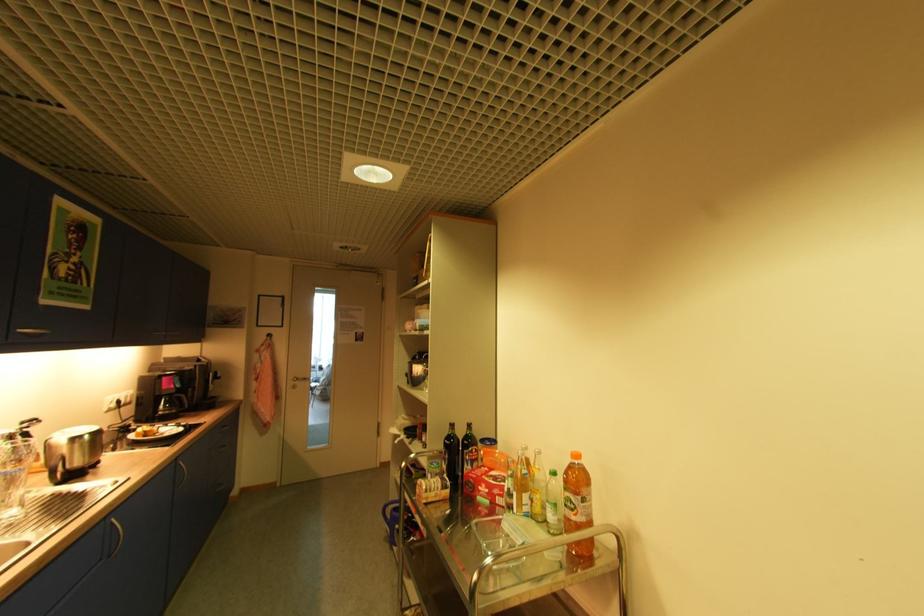
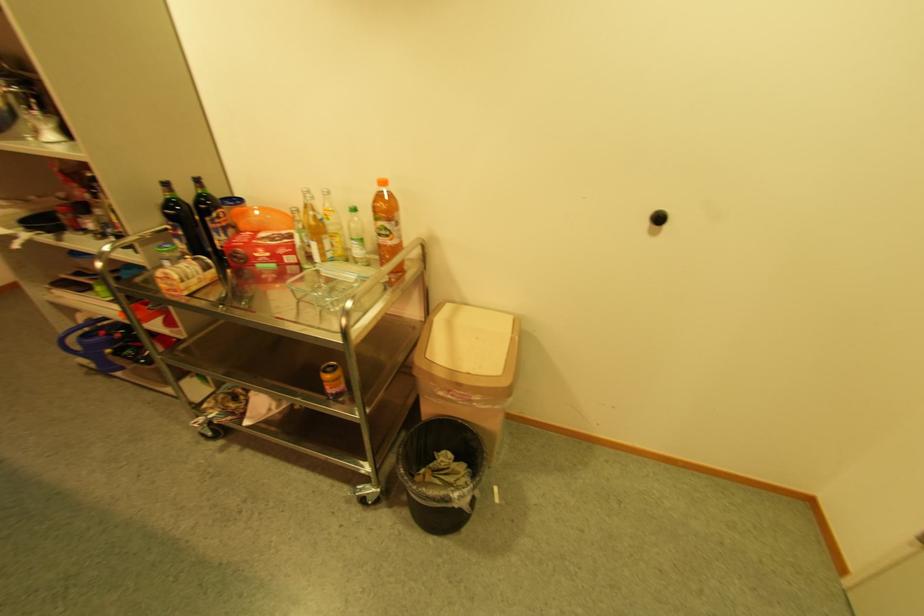
Find the pixel in the second image that matches (473,467) in the first image.

(225, 237)